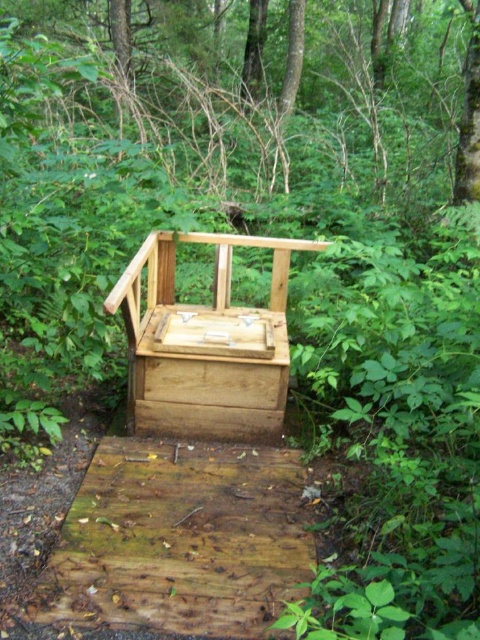
Question: Which of the following is the farthest from the observer?

Choices:
 (A) (176, 3)
 (B) (140, 339)

Answer: (A)

Question: Where is brown wood tree at upper center located in relation to natural wood chair at center in the image?

Choices:
 (A) below
 (B) above

Answer: (B)

Question: Does brown wood tree at upper center have a greater width compared to natural wood chair at center?

Choices:
 (A) no
 (B) yes

Answer: (A)

Question: Can you confirm if brown wood tree at upper center is smaller than natural wood chair at center?

Choices:
 (A) no
 (B) yes

Answer: (B)